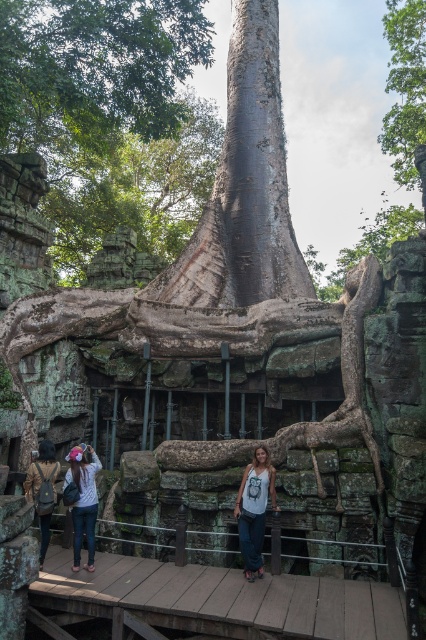
Does green mossy stone at center appear on the left side of denim pants at lower left?

Incorrect, green mossy stone at center is not on the left side of denim pants at lower left.

Can you confirm if green mossy stone at center is positioned below denim pants at lower left?

Incorrect, green mossy stone at center is not positioned below denim pants at lower left.

Does point (345, 392) come in front of point (63, 484)?

No, it is behind (63, 484).

Locate an element on the screen. The height and width of the screenshot is (640, 426). green mossy stone at center is located at coordinates [x=342, y=378].

This screenshot has height=640, width=426. I want to click on white tank top at center, so click(x=255, y=508).

Is white tank top at center wider than denim pants at lower left?

Indeed, white tank top at center has a greater width compared to denim pants at lower left.

Locate an element on the screen. The width and height of the screenshot is (426, 640). white tank top at center is located at coordinates (255, 508).

Can you confirm if green leafy tree at upper left is thinner than white tank top at center?

In fact, green leafy tree at upper left might be wider than white tank top at center.

Locate an element on the screen. The height and width of the screenshot is (640, 426). green leafy tree at upper left is located at coordinates (94, 68).